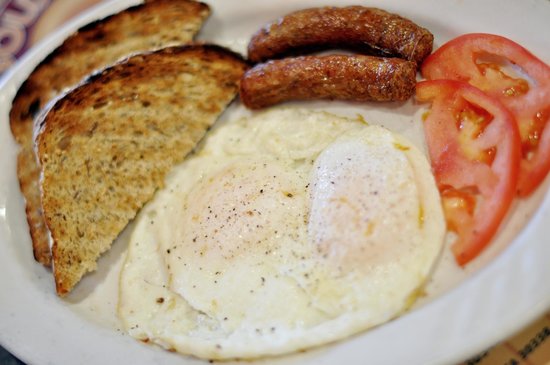
I want to click on plate, so click(x=450, y=332), click(x=446, y=21), click(x=50, y=49).